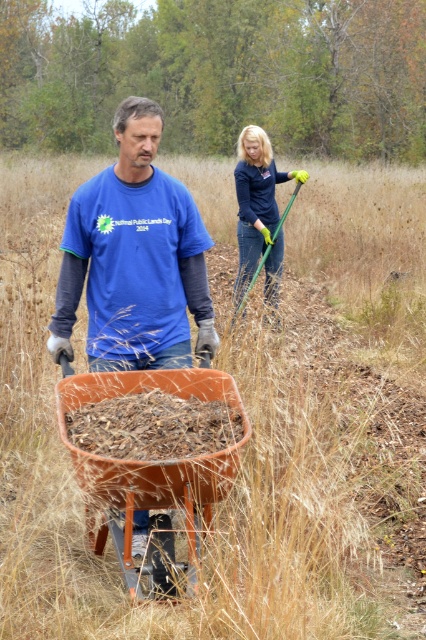
Is matte blue shirt at center bigger than dark blue fabric rake at upper right?

Actually, matte blue shirt at center might be smaller than dark blue fabric rake at upper right.

Does matte blue shirt at center have a greater height compared to dark blue fabric rake at upper right?

In fact, matte blue shirt at center may be shorter than dark blue fabric rake at upper right.

Between point (78, 266) and point (271, 268), which one is positioned in front?

Point (78, 266)

Identify the location of matte blue shirt at center. This screenshot has width=426, height=640. (135, 257).

Is point (161, 592) farther from viewer compared to point (249, 227)?

No, (161, 592) is in front of (249, 227).

Does orange plastic cart at center appear on the right side of dark blue fabric rake at upper right?

In fact, orange plastic cart at center is to the left of dark blue fabric rake at upper right.

This screenshot has width=426, height=640. I want to click on orange plastic cart at center, so click(152, 460).

Does matte blue shirt at center have a lesser height compared to orange plastic cart at center?

No.

Between matte blue shirt at center and orange plastic cart at center, which one has more height?

With more height is matte blue shirt at center.

I want to click on matte blue shirt at center, so click(x=135, y=257).